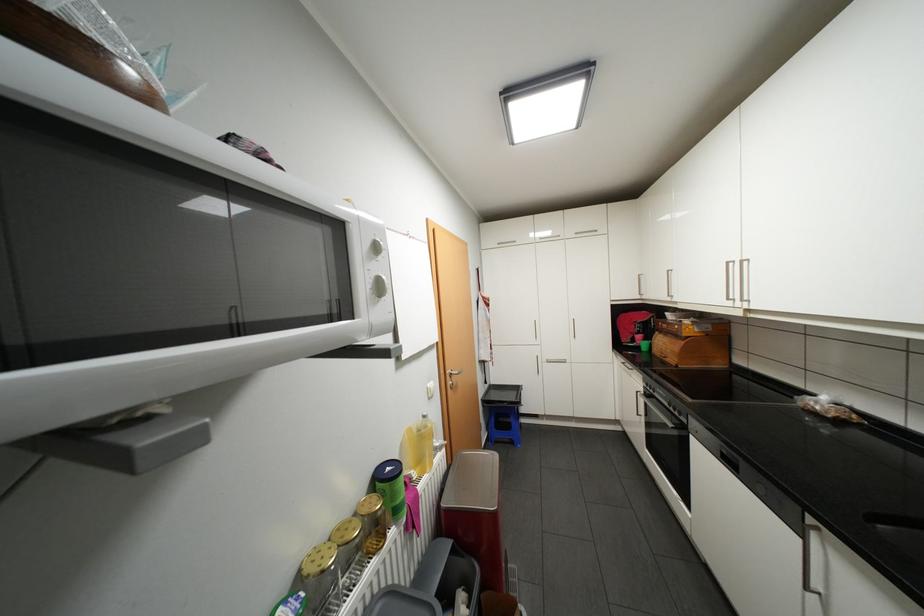
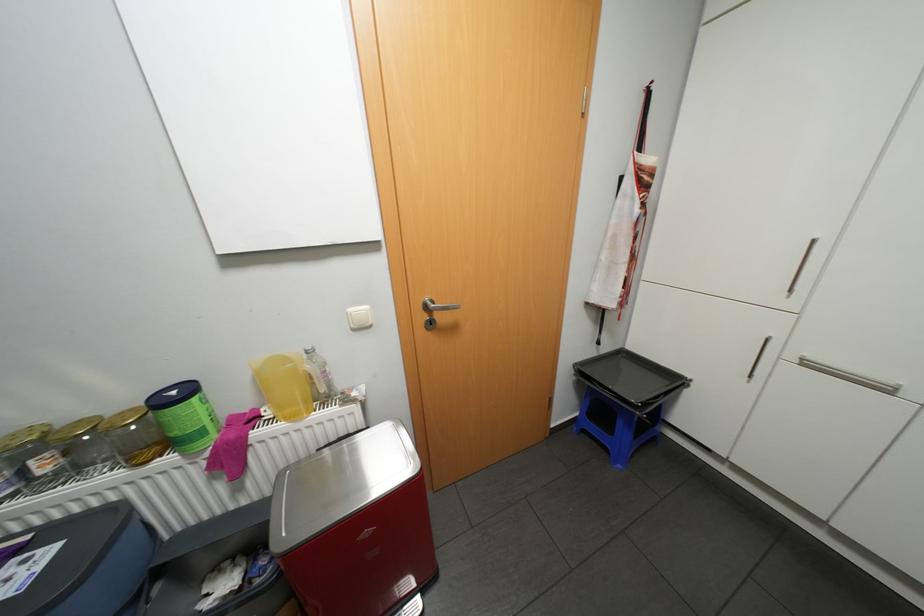
Where in the second image is the point corresponding to point 525,387 from the first image?

(684, 379)